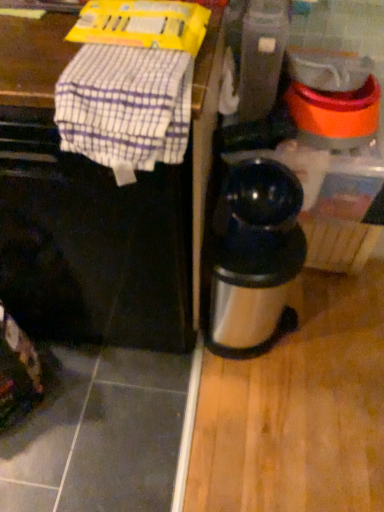
Question: Is white checkered cloth at upper left inside or outside of black matte coffee maker at center?

Choices:
 (A) inside
 (B) outside

Answer: (A)

Question: In the image, is white checkered cloth at upper left on the left side or the right side of black matte coffee maker at center?

Choices:
 (A) left
 (B) right

Answer: (B)

Question: Considering the real-world distances, which object is closest to the white checkered cloth at upper left?

Choices:
 (A) black matte coffee maker at center
 (B) stainless steel thermos at right
 (C) metallic gray blender at center

Answer: (A)

Question: Which object is positioned farthest from the stainless steel thermos at right?

Choices:
 (A) black matte coffee maker at center
 (B) white checkered cloth at upper left
 (C) metallic gray blender at center

Answer: (B)